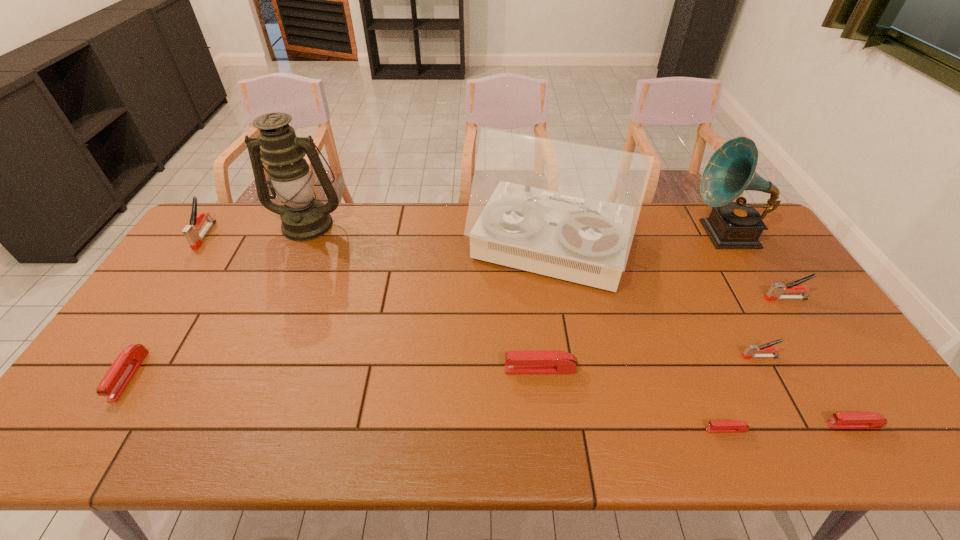
What are the coordinates of `the third object from left to right` in the screenshot? It's located at (303, 219).

You are a GUI agent. You are given a task and a screenshot of the screen. Output one action in this format:
    pyautogui.click(x=<x>, y=<y>)
    Task: Click on the record player
    
    Given the screenshot: What is the action you would take?
    pyautogui.click(x=566, y=210)

Image resolution: width=960 pixels, height=540 pixels. In order to click on the third tallest object in this screenshot , I will do `click(731, 170)`.

You are a GUI agent. You are given a task and a screenshot of the screen. Output one action in this format:
    pyautogui.click(x=<x>, y=<y>)
    Task: Click on the fourth tallest object
    Image resolution: width=960 pixels, height=540 pixels.
    Given the screenshot: What is the action you would take?
    [190, 232]

Locate an element on the screen. This screenshot has height=540, width=960. the farthest gray stapler is located at coordinates (190, 232).

You are a GUI agent. You are given a task and a screenshot of the screen. Output one action in this format:
    pyautogui.click(x=<x>, y=<y>)
    Task: Click on the second smallest gray stapler
    The height and width of the screenshot is (540, 960).
    Given the screenshot: What is the action you would take?
    pyautogui.click(x=775, y=292)

This screenshot has width=960, height=540. I want to click on the sixth shortest object, so click(775, 292).

Identify the location of the nearest gray stapler. The width and height of the screenshot is (960, 540). (750, 352).

Identify the location of the fifth stapler from left to right. Image resolution: width=960 pixels, height=540 pixels. (750, 352).

Find the location of a particular element. The width and height of the screenshot is (960, 540). the biggest red stapler is located at coordinates click(537, 361).